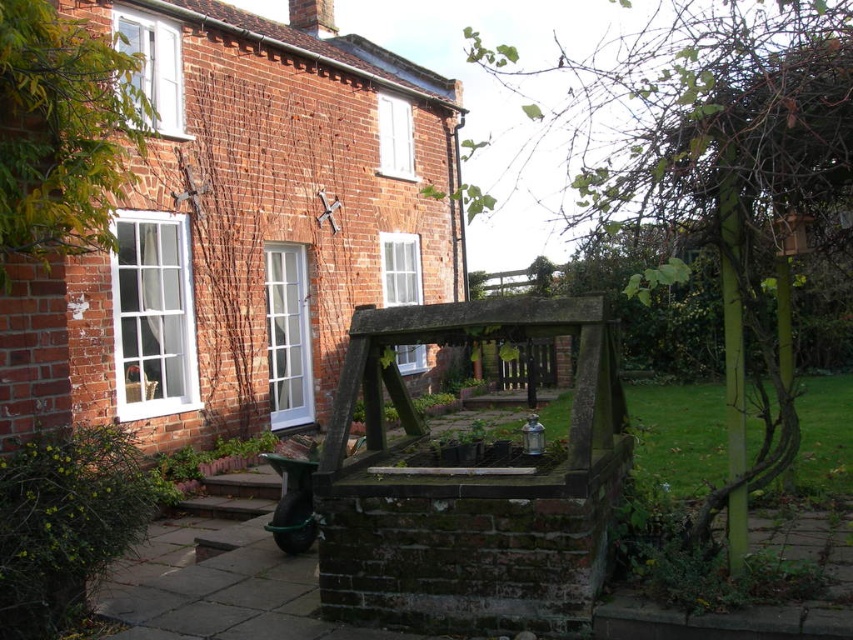
You are standing in front of the brick house and want to walk towards the two points marked in the image. Which point, point (103,458) or point (193,513), will you reach first?

Point (103,458) is closer to the viewer than point (193,513), so you will reach point (103,458) first.

You are standing at the entrance of the brick house and want to reach the brown wooden stairs at lower left. However, there is a green leafy bush at lower left blocking your path. Can you walk around the bush to reach the stairs?

The green leafy bush at lower left is to the left of brown wooden stairs at lower left, so you can walk around the bush on the right side to reach the stairs.